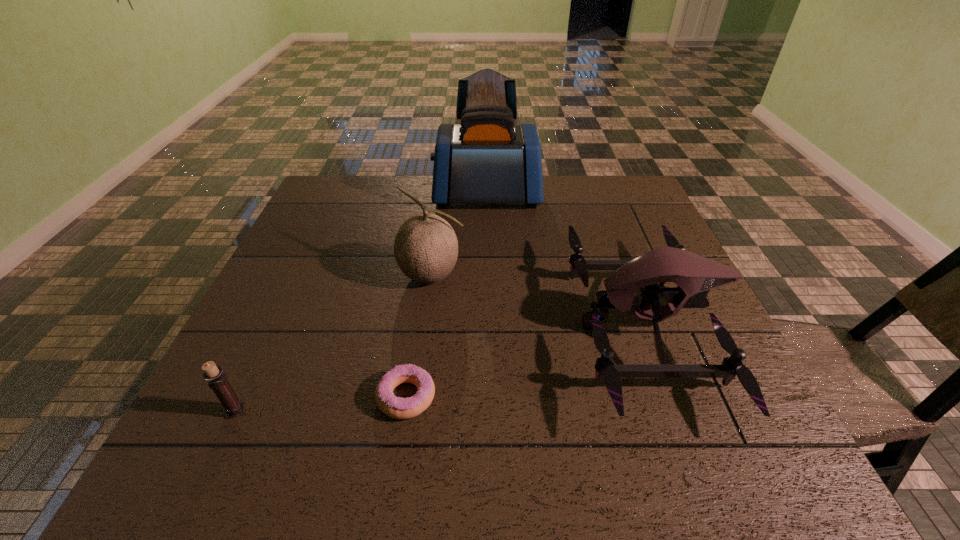
At what (x,y) coordinates should I click in order to perform the action: click on vacant area located 0.050m on the front of the cantaloup. Please return your answer as a coordinate pair (x, y). The image size is (960, 540). Looking at the image, I should click on (427, 310).

This screenshot has height=540, width=960. I want to click on vacant space located on the front-facing side of the rightmost object, so click(x=536, y=327).

What are the coordinates of `vacant space located 0.140m on the front-facing side of the rightmost object` in the screenshot? It's located at [x=514, y=327].

You are a GUI agent. You are given a task and a screenshot of the screen. Output one action in this format:
    pyautogui.click(x=<x>, y=<y>)
    Task: Click on the vacant space located on the front-facing side of the rightmost object
    
    Given the screenshot: What is the action you would take?
    pyautogui.click(x=473, y=327)

You are a GUI agent. You are given a task and a screenshot of the screen. Output one action in this format:
    pyautogui.click(x=<x>, y=<y>)
    Task: Click on the blank space located on the right of the leftmost object
    The width and height of the screenshot is (960, 540).
    Given the screenshot: What is the action you would take?
    pyautogui.click(x=359, y=410)

Locate an element on the screen. The width and height of the screenshot is (960, 540). vacant area situated 0.240m on the right of the shortest object is located at coordinates (561, 396).

Identify the location of object located at the far edge. This screenshot has width=960, height=540. (487, 159).

At what (x,y) coordinates should I click in order to perform the action: click on object present at the near edge. Please return your answer as a coordinate pair (x, y). Image resolution: width=960 pixels, height=540 pixels. Looking at the image, I should click on (695, 275).

Image resolution: width=960 pixels, height=540 pixels. Identify the location of object located at the left edge. (217, 381).

Find the location of a particular element. This screenshot has width=960, height=540. object located at the right edge is located at coordinates (695, 275).